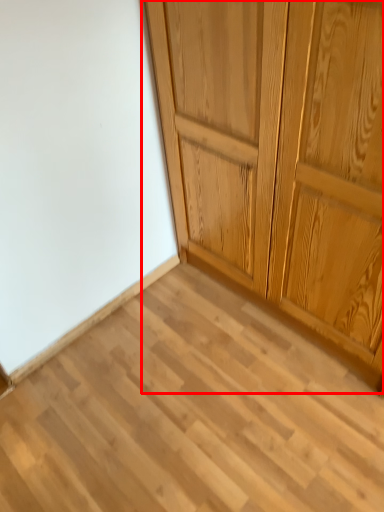
Question: From the image's perspective, what is the correct spatial positioning of cupboard (annotated by the red box) in reference to plank?

Choices:
 (A) above
 (B) below

Answer: (A)